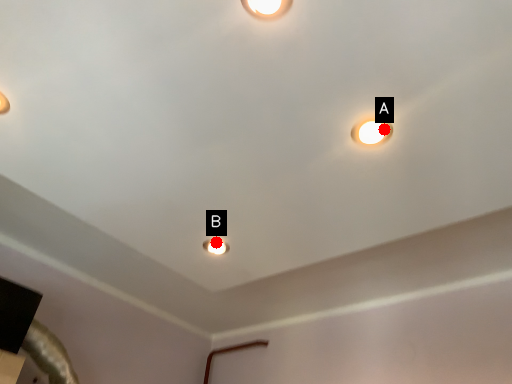
Question: Two points are circled on the image, labeled by A and B beside each circle. Which point is closer to the camera?

Choices:
 (A) A is closer
 (B) B is closer

Answer: (A)